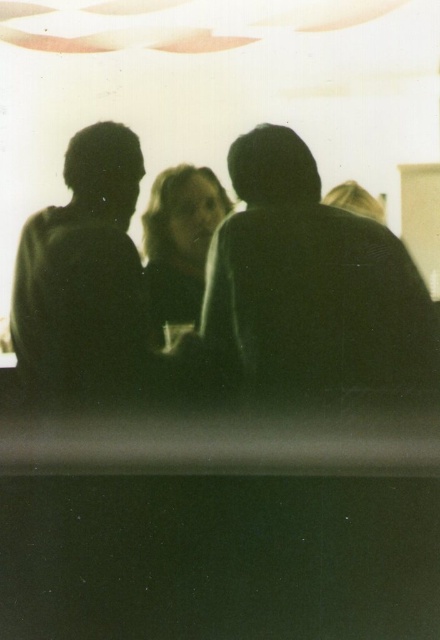
You are planning to place a small decorative item between the black matte people at center and the black matte head at left. Based on their relative widths, which object should you place the item closer to?

The black matte people at center might be wider than black matte head at left, so you should place the item closer to the black matte head at left to ensure proper spacing.

You are a photographer trying to capture a group photo of the black matte head at left and the smooth skin face at center. Which one should you focus on first if you want to ensure both are in focus?

The black matte head at left is bigger than the smooth skin face at center, so focusing on the black matte head at left first would help ensure both are in focus as it requires more precise focus due to its larger size.

You are a photographer trying to capture a closeup of the smooth skin face at center while ensuring the black matte people at center remains visible in the background. Based on their sizes, is this possible?

The black matte people at center has a larger size compared to smooth skin face at center, so capturing a closeup of the smooth skin face at center may cause the black matte people at center to appear smaller in the background, but they should still remain visible as long as they are within the camera frame.